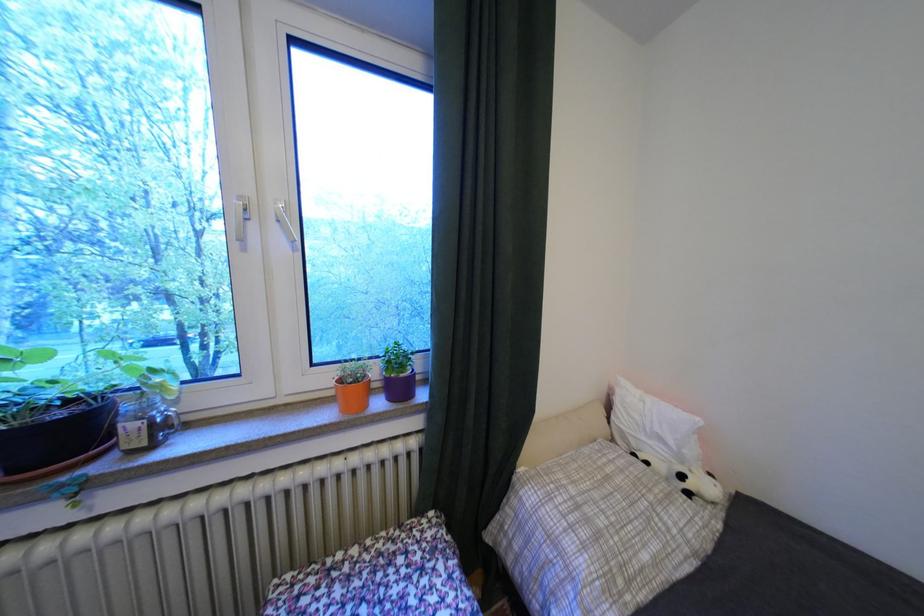
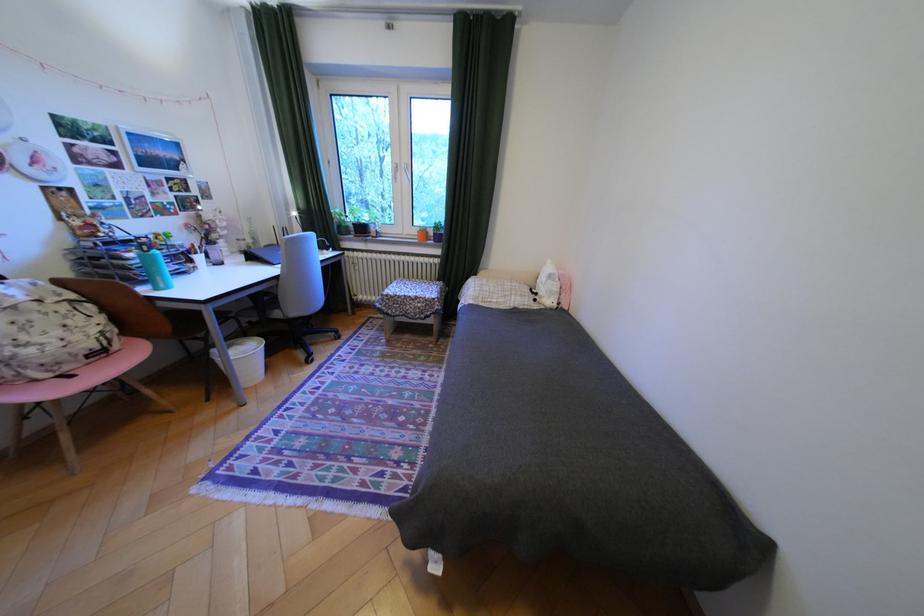
In the second image, find the point that corresponds to the point at 694,477 in the first image.

(548, 294)